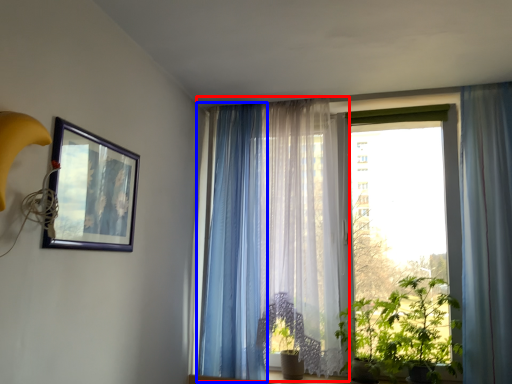
Question: Which object is closer to the camera taking this photo, curtain (highlighted by a red box) or curtain (highlighted by a blue box)?

Choices:
 (A) curtain
 (B) curtain

Answer: (A)